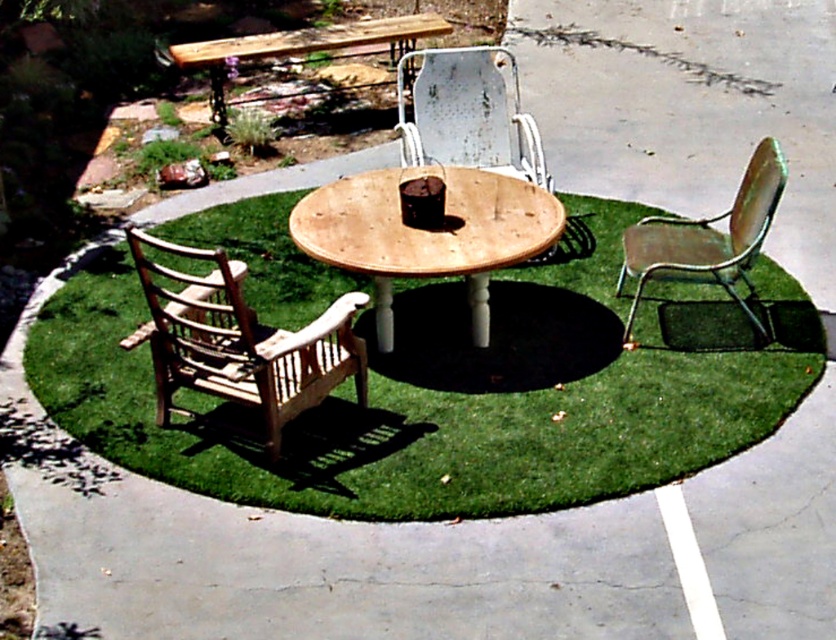
Question: Which point is farther from the camera taking this photo?

Choices:
 (A) (220, 48)
 (B) (403, 312)
 (C) (415, 81)
 (D) (650, 218)

Answer: (A)

Question: Does green artificial grass at center have a lesser width compared to light brown wooden chair at lower left?

Choices:
 (A) yes
 (B) no

Answer: (B)

Question: Observing the image, what is the correct spatial positioning of green artificial grass at center in reference to natural wood table at center?

Choices:
 (A) below
 (B) above

Answer: (A)

Question: Among these objects, which one is nearest to the camera?

Choices:
 (A) green metal chair at right
 (B) light brown wooden chair at lower left

Answer: (B)

Question: Where is light brown wooden chair at lower left located in relation to wooden table at upper center in the image?

Choices:
 (A) below
 (B) above

Answer: (A)

Question: Which point is closer to the camera?

Choices:
 (A) (487, 202)
 (B) (187, 61)

Answer: (A)